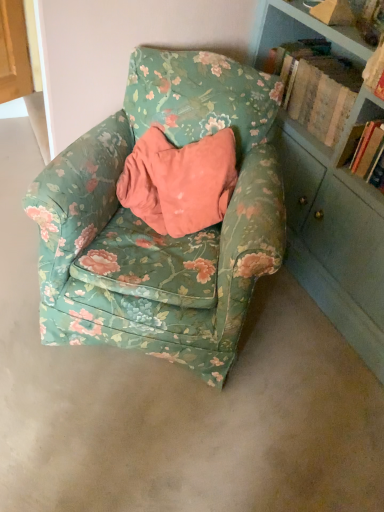
Question: Would you say floral fabric armchair at center is outside hardcover book at right, positioned as the 1th book in bottom-to-top order?

Choices:
 (A) yes
 (B) no

Answer: (A)

Question: Is the position of floral fabric armchair at center more distant than that of hardcover book at right, acting as the 2th book starting from the top?

Choices:
 (A) no
 (B) yes

Answer: (A)

Question: From a real-world perspective, does floral fabric armchair at center stand above hardcover book at right, positioned as the 1th book in bottom-to-top order?

Choices:
 (A) no
 (B) yes

Answer: (A)

Question: Is floral fabric armchair at center at the right side of hardcover book at right, positioned as the 1th book in bottom-to-top order?

Choices:
 (A) yes
 (B) no

Answer: (B)

Question: Is floral fabric armchair at center directly adjacent to hardcover book at right, positioned as the 1th book in bottom-to-top order?

Choices:
 (A) yes
 (B) no

Answer: (B)

Question: Based on their positions, is floral fabric armchair at center located to the left or right of wooden book at upper right, the first book from the top?

Choices:
 (A) right
 (B) left

Answer: (B)

Question: From a real-world perspective, relative to wooden book at upper right, positioned as the 2th book in bottom-to-top order, is floral fabric armchair at center vertically above or below?

Choices:
 (A) above
 (B) below

Answer: (B)

Question: From their relative heights in the image, would you say floral fabric armchair at center is taller or shorter than wooden book at upper right, positioned as the 2th book in bottom-to-top order?

Choices:
 (A) short
 (B) tall

Answer: (B)

Question: Is floral fabric armchair at center situated inside wooden book at upper right, positioned as the 2th book in bottom-to-top order, or outside?

Choices:
 (A) inside
 (B) outside

Answer: (B)

Question: Based on their positions, is floral fabric armchair at center located to the left or right of hardcover book at right, positioned as the 1th book in bottom-to-top order?

Choices:
 (A) right
 (B) left

Answer: (B)

Question: From a real-world perspective, is floral fabric armchair at center physically located above or below hardcover book at right, positioned as the 1th book in bottom-to-top order?

Choices:
 (A) above
 (B) below

Answer: (B)

Question: Does point (82, 334) appear closer or farther from the camera than point (372, 142)?

Choices:
 (A) closer
 (B) farther

Answer: (A)

Question: Do you think floral fabric armchair at center is within hardcover book at right, acting as the 2th book starting from the top, or outside of it?

Choices:
 (A) inside
 (B) outside

Answer: (B)

Question: Based on their sizes in the image, would you say hardcover book at right, positioned as the 1th book in bottom-to-top order, is bigger or smaller than wooden book at upper right, the first book from the top?

Choices:
 (A) small
 (B) big

Answer: (A)

Question: From the image's perspective, is hardcover book at right, acting as the 2th book starting from the top, positioned above or below wooden book at upper right, the first book from the top?

Choices:
 (A) below
 (B) above

Answer: (A)